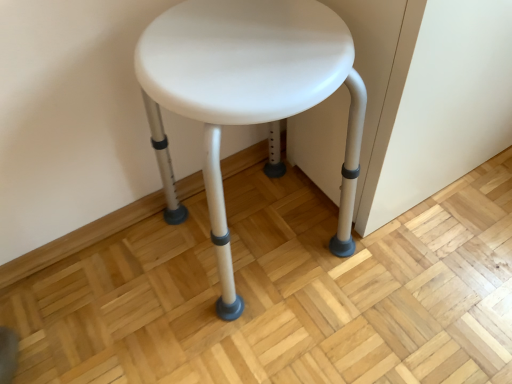
Where is `vacant area to the left of white plastic stool at center`? The height and width of the screenshot is (384, 512). vacant area to the left of white plastic stool at center is located at coordinates (124, 288).